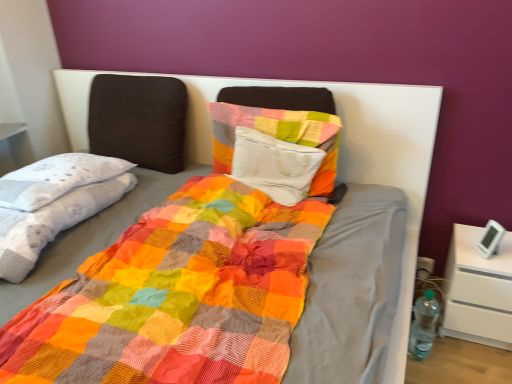
Question: Is textured cotton pillow at center not near multicolored patchwork blanket at left?

Choices:
 (A) no
 (B) yes

Answer: (A)

Question: Considering the relative sizes of textured cotton pillow at center and multicolored patchwork blanket at left in the image provided, is textured cotton pillow at center shorter than multicolored patchwork blanket at left?

Choices:
 (A) no
 (B) yes

Answer: (A)

Question: Considering the relative sizes of textured cotton pillow at center and multicolored patchwork blanket at left in the image provided, is textured cotton pillow at center smaller than multicolored patchwork blanket at left?

Choices:
 (A) yes
 (B) no

Answer: (A)

Question: Does textured cotton pillow at center lie in front of multicolored patchwork blanket at left?

Choices:
 (A) no
 (B) yes

Answer: (A)

Question: Is textured cotton pillow at center beside multicolored patchwork blanket at left?

Choices:
 (A) yes
 (B) no

Answer: (B)

Question: Is clear plastic bottle at right bigger or smaller than textured cotton pillow at center?

Choices:
 (A) big
 (B) small

Answer: (B)

Question: From the image's perspective, relative to textured cotton pillow at center, is clear plastic bottle at right above or below?

Choices:
 (A) above
 (B) below

Answer: (B)

Question: In the image, is clear plastic bottle at right on the left side or the right side of textured cotton pillow at center?

Choices:
 (A) left
 (B) right

Answer: (B)

Question: Does point (414, 304) appear closer or farther from the camera than point (229, 157)?

Choices:
 (A) closer
 (B) farther

Answer: (B)

Question: From a real-world perspective, relative to white matte nightstand at lower right, is textured cotton pillow at center vertically above or below?

Choices:
 (A) below
 (B) above

Answer: (B)

Question: Considering the positions of textured cotton pillow at center and white matte nightstand at lower right in the image, is textured cotton pillow at center wider or thinner than white matte nightstand at lower right?

Choices:
 (A) thin
 (B) wide

Answer: (A)

Question: Considering the positions of textured cotton pillow at center and white matte nightstand at lower right in the image, is textured cotton pillow at center taller or shorter than white matte nightstand at lower right?

Choices:
 (A) tall
 (B) short

Answer: (B)

Question: In the image, is textured cotton pillow at center positioned in front of or behind white matte nightstand at lower right?

Choices:
 (A) behind
 (B) front

Answer: (A)

Question: From a real-world perspective, relative to textured cotton pillow at center, is multicolored patchwork blanket at left vertically above or below?

Choices:
 (A) below
 (B) above

Answer: (A)

Question: Looking at their shapes, would you say multicolored patchwork blanket at left is wider or thinner than textured cotton pillow at center?

Choices:
 (A) thin
 (B) wide

Answer: (B)